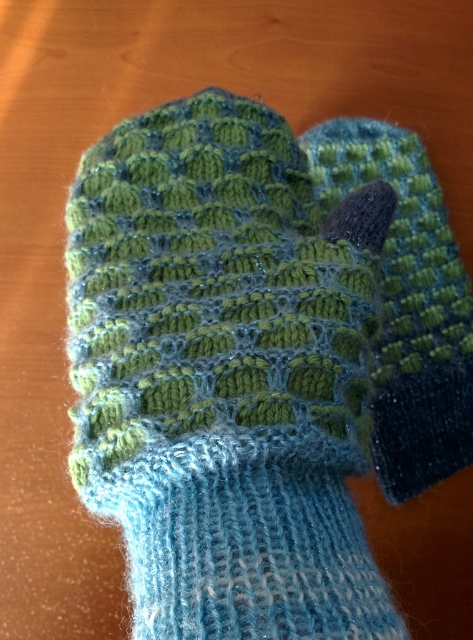
Can you confirm if knitted woolen glove at center is positioned to the left of green knitted sock at center?

Indeed, knitted woolen glove at center is positioned on the left side of green knitted sock at center.

Who is more distant from viewer, (176, 497) or (444, 227)?

Point (444, 227)

Locate an element on the screen. knitted woolen glove at center is located at coordinates (226, 374).